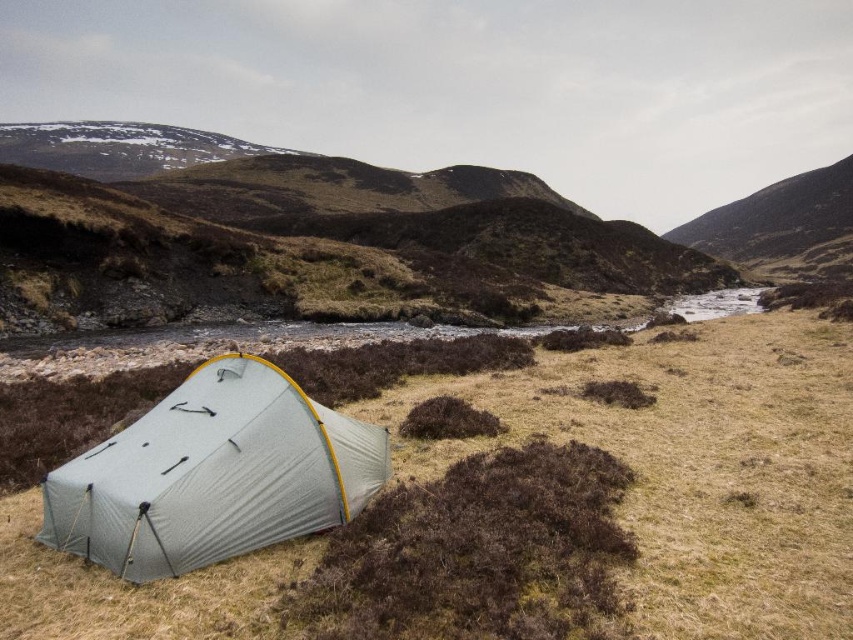
You are planning to set up a new tent in this camping area. The green fabric tent at lower left and the brown grassy hillside at center are both potential spots. Which location has a wider area for setting up a tent?

The brown grassy hillside at center has a wider area than the green fabric tent at lower left, so it is more suitable for setting up a tent.

You are planning to set up a new tent in this camping area. The green fabric tent at lower left is currently occupying space near the brown grassy hillside at center. Considering their sizes, which object would require more space to accommodate?

The brown grassy hillside at center requires more space because it is larger than the green fabric tent at lower left.